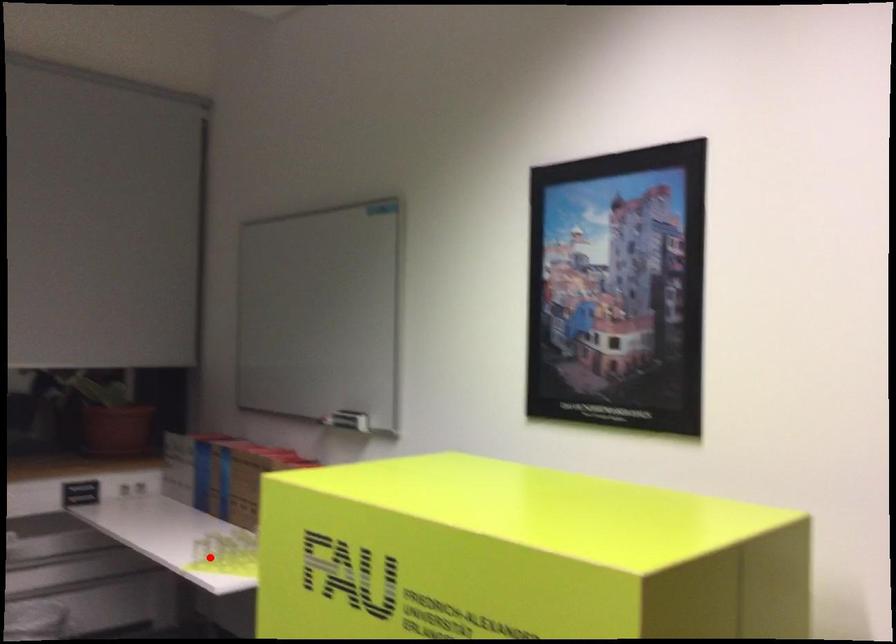
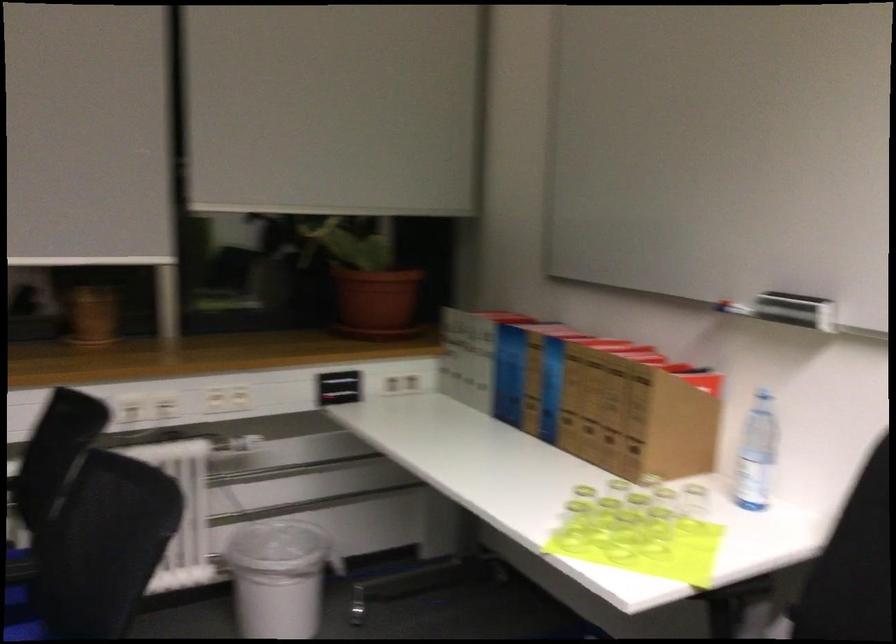
Locate, in the second image, the point that corresponds to the highlighted location in the first image.

(573, 526)